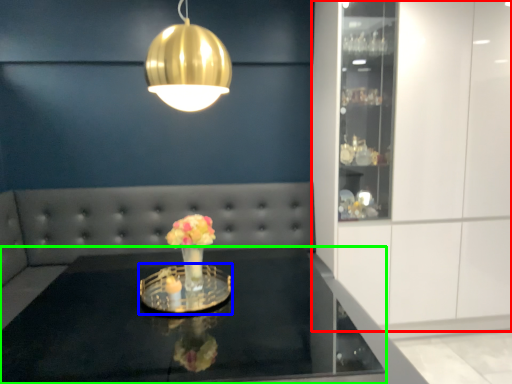
Question: Estimate the real-world distances between objects in this image. Which object is farther from cabinetry (highlighted by a red box), glass plate (highlighted by a blue box) or table (highlighted by a green box)?

Choices:
 (A) glass plate
 (B) table

Answer: (A)